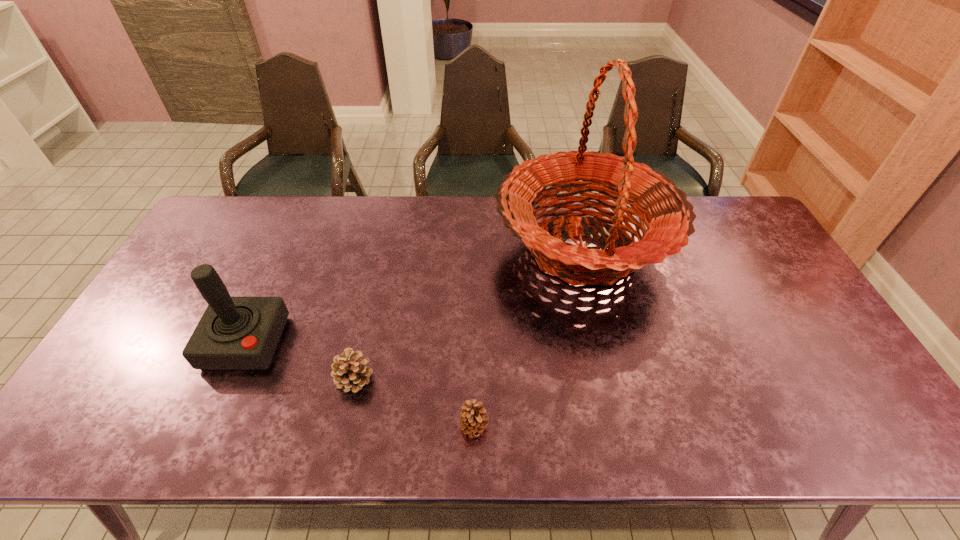
Find the location of a particular element. vacant space that satisfies the following two spatial constraints: 1. on the back side of the basket; 2. on the left side of the nearer pinecone is located at coordinates (476, 248).

The height and width of the screenshot is (540, 960). Find the location of `free space that satisfies the following two spatial constraints: 1. on the base of the joystick; 2. on the left side of the left pinecone`. free space that satisfies the following two spatial constraints: 1. on the base of the joystick; 2. on the left side of the left pinecone is located at coordinates (229, 379).